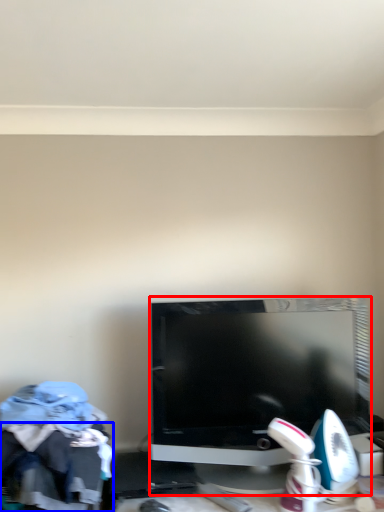
Question: Which object appears closest to the camera in this image, television (highlighted by a red box) or clothing (highlighted by a blue box)?

Choices:
 (A) television
 (B) clothing

Answer: (B)